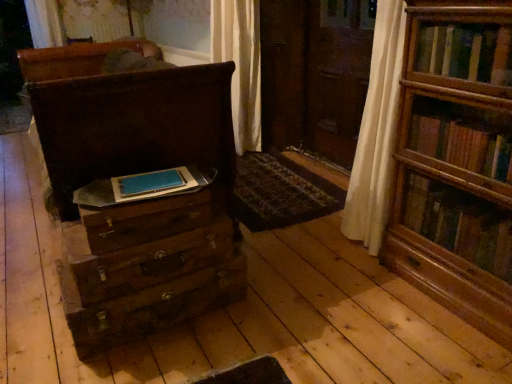
Question: From the image's perspective, is wooden drawer at lower left, which appears as the third drawer when ordered from the bottom, above wooden drawer at center, the 1th drawer in the bottom-to-top sequence?

Choices:
 (A) yes
 (B) no

Answer: (A)

Question: Is wooden drawer at lower left, the 1th drawer when ordered from top to bottom, far from wooden drawer at center, marked as the third drawer in a top-to-bottom arrangement?

Choices:
 (A) no
 (B) yes

Answer: (A)

Question: Considering the relative sizes of wooden drawer at lower left, the 1th drawer when ordered from top to bottom, and wooden drawer at center, the 1th drawer in the bottom-to-top sequence, in the image provided, is wooden drawer at lower left, the 1th drawer when ordered from top to bottom, taller than wooden drawer at center, the 1th drawer in the bottom-to-top sequence,?

Choices:
 (A) yes
 (B) no

Answer: (B)

Question: Is the depth of wooden drawer at lower left, the 1th drawer when ordered from top to bottom, less than that of wooden drawer at center, the 1th drawer in the bottom-to-top sequence?

Choices:
 (A) yes
 (B) no

Answer: (A)

Question: Is wooden drawer at lower left, which appears as the third drawer when ordered from the bottom, to the right of wooden drawer at center, the 1th drawer in the bottom-to-top sequence, from the viewer's perspective?

Choices:
 (A) yes
 (B) no

Answer: (A)

Question: Can you see wooden drawer at lower left, which appears as the third drawer when ordered from the bottom, touching wooden drawer at center, marked as the third drawer in a top-to-bottom arrangement?

Choices:
 (A) no
 (B) yes

Answer: (A)

Question: Would you consider blue matte paper at center to be distant from matte brown chest of drawers at left?

Choices:
 (A) yes
 (B) no

Answer: (B)

Question: From the image's perspective, is blue matte paper at center located above matte brown chest of drawers at left?

Choices:
 (A) yes
 (B) no

Answer: (B)

Question: Can you confirm if blue matte paper at center is taller than matte brown chest of drawers at left?

Choices:
 (A) no
 (B) yes

Answer: (A)

Question: Can you confirm if blue matte paper at center is bigger than matte brown chest of drawers at left?

Choices:
 (A) yes
 (B) no

Answer: (B)

Question: Is blue matte paper at center looking in the opposite direction of matte brown chest of drawers at left?

Choices:
 (A) yes
 (B) no

Answer: (B)

Question: Does blue matte paper at center appear on the right side of matte brown chest of drawers at left?

Choices:
 (A) no
 (B) yes

Answer: (B)

Question: Can you see wooden drawer at lower left, the 1th drawer when ordered from top to bottom, touching wooden bookshelf at right?

Choices:
 (A) yes
 (B) no

Answer: (B)